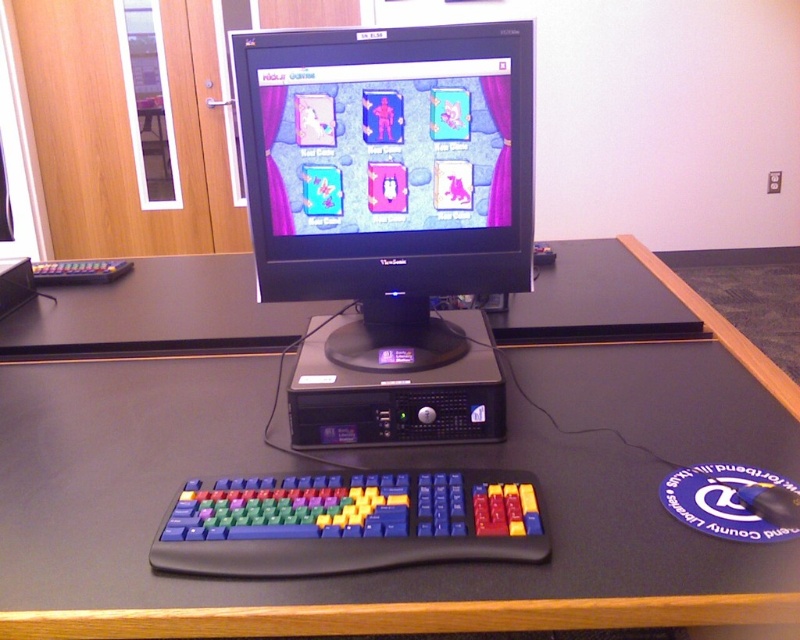
Who is shorter, black matte table at center or multicolored plastic keyboard at lower center?

Standing shorter between the two is multicolored plastic keyboard at lower center.

Which is more to the left, black matte table at center or multicolored plastic keyboard at lower center?

black matte table at center

I want to click on black matte table at center, so click(x=304, y=472).

Is black plastic desktop computer at center to the right of multicolored plastic keyboard at lower center from the viewer's perspective?

Yes, black plastic desktop computer at center is to the right of multicolored plastic keyboard at lower center.

I want to click on black plastic desktop computer at center, so pyautogui.click(x=389, y=212).

This screenshot has height=640, width=800. What are the coordinates of `black plastic desktop computer at center` in the screenshot? It's located at (389, 212).

Can you confirm if black matte table at center is smaller than black plastic desktop computer at center?

No, black matte table at center is not smaller than black plastic desktop computer at center.

Who is more distant from viewer, (x=32, y=556) or (x=446, y=365)?

Point (x=446, y=365)

Image resolution: width=800 pixels, height=640 pixels. What do you see at coordinates (304, 472) in the screenshot? I see `black matte table at center` at bounding box center [304, 472].

Find the location of a particular element. The image size is (800, 640). black matte table at center is located at coordinates (304, 472).